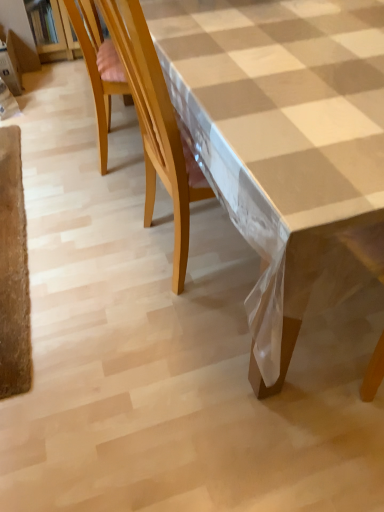
Question: Considering the positions of white checkered tablecloth at center and wooden chair at left in the image, is white checkered tablecloth at center bigger or smaller than wooden chair at left?

Choices:
 (A) small
 (B) big

Answer: (B)

Question: Is point (360, 125) positioned closer to the camera than point (81, 9)?

Choices:
 (A) closer
 (B) farther

Answer: (A)

Question: In the image, is white checkered tablecloth at center positioned in front of or behind wooden chair at left?

Choices:
 (A) front
 (B) behind

Answer: (A)

Question: In the image, is wooden chair at left on the left side or the right side of white checkered tablecloth at center?

Choices:
 (A) right
 (B) left

Answer: (B)

Question: From the image's perspective, is wooden chair at left above or below white checkered tablecloth at center?

Choices:
 (A) below
 (B) above

Answer: (B)

Question: Is wooden chair at left taller or shorter than white checkered tablecloth at center?

Choices:
 (A) short
 (B) tall

Answer: (A)

Question: Is wooden chair at left wider or thinner than white checkered tablecloth at center?

Choices:
 (A) thin
 (B) wide

Answer: (A)